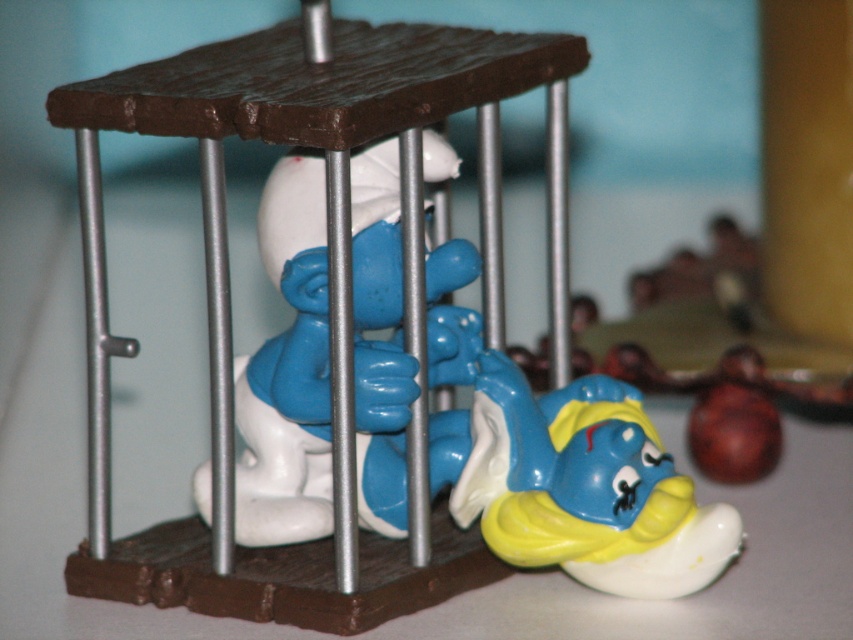
Question: Among these objects, which one is farthest from the camera?

Choices:
 (A) blue plastic toy at center
 (B) blue glossy smurf at lower right

Answer: (B)

Question: Can you confirm if blue plastic toy at center is positioned to the left of blue glossy smurf at lower right?

Choices:
 (A) yes
 (B) no

Answer: (A)

Question: Is blue plastic toy at center behind blue glossy smurf at lower right?

Choices:
 (A) no
 (B) yes

Answer: (A)

Question: Where is blue plastic toy at center located in relation to blue glossy smurf at lower right in the image?

Choices:
 (A) left
 (B) right

Answer: (A)